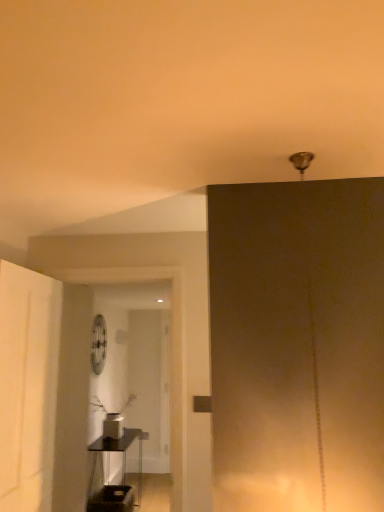
Question: Is metallic circular fan at center positioned before metallic black shelf at lower left?

Choices:
 (A) yes
 (B) no

Answer: (B)

Question: Is metallic circular fan at center outside metallic black shelf at lower left?

Choices:
 (A) yes
 (B) no

Answer: (A)

Question: Is metallic circular fan at center to the left of metallic black shelf at lower left from the viewer's perspective?

Choices:
 (A) no
 (B) yes

Answer: (B)

Question: From a real-world perspective, is metallic circular fan at center on top of metallic black shelf at lower left?

Choices:
 (A) yes
 (B) no

Answer: (A)

Question: Is metallic circular fan at center directly adjacent to metallic black shelf at lower left?

Choices:
 (A) yes
 (B) no

Answer: (B)

Question: From the image's perspective, would you say metallic circular fan at center is positioned over metallic black shelf at lower left?

Choices:
 (A) yes
 (B) no

Answer: (A)

Question: Are metallic black shelf at lower left and metallic circular fan at center far apart?

Choices:
 (A) yes
 (B) no

Answer: (B)

Question: Is metallic black shelf at lower left in contact with metallic circular fan at center?

Choices:
 (A) no
 (B) yes

Answer: (A)

Question: From a real-world perspective, is metallic black shelf at lower left located higher than metallic circular fan at center?

Choices:
 (A) yes
 (B) no

Answer: (B)

Question: Is metallic black shelf at lower left located outside metallic circular fan at center?

Choices:
 (A) yes
 (B) no

Answer: (A)

Question: Is metallic black shelf at lower left to the left of metallic circular fan at center from the viewer's perspective?

Choices:
 (A) no
 (B) yes

Answer: (A)

Question: Does metallic black shelf at lower left appear on the right side of metallic circular fan at center?

Choices:
 (A) no
 (B) yes

Answer: (B)

Question: Is metallic black shelf at lower left spatially inside metallic circular fan at center, or outside of it?

Choices:
 (A) inside
 (B) outside

Answer: (B)